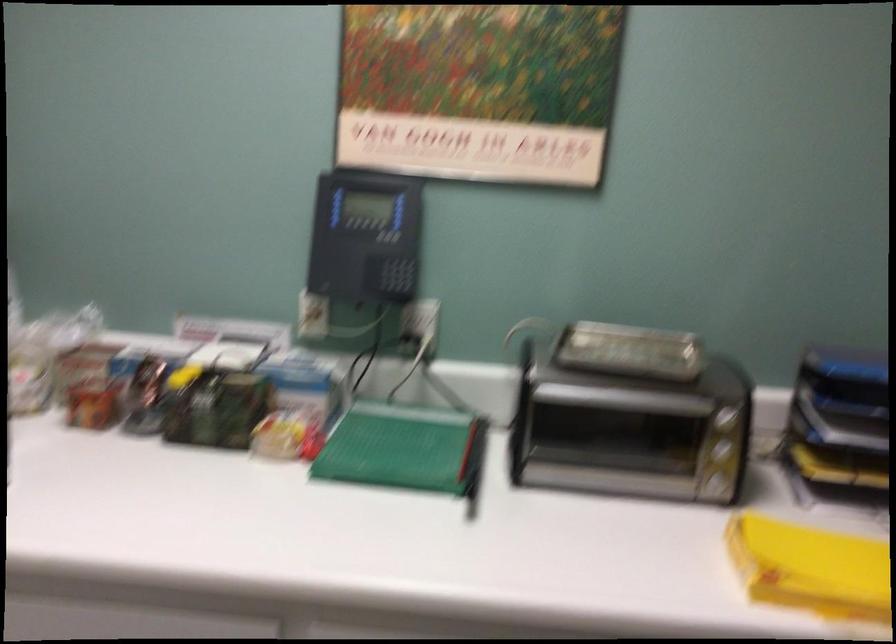
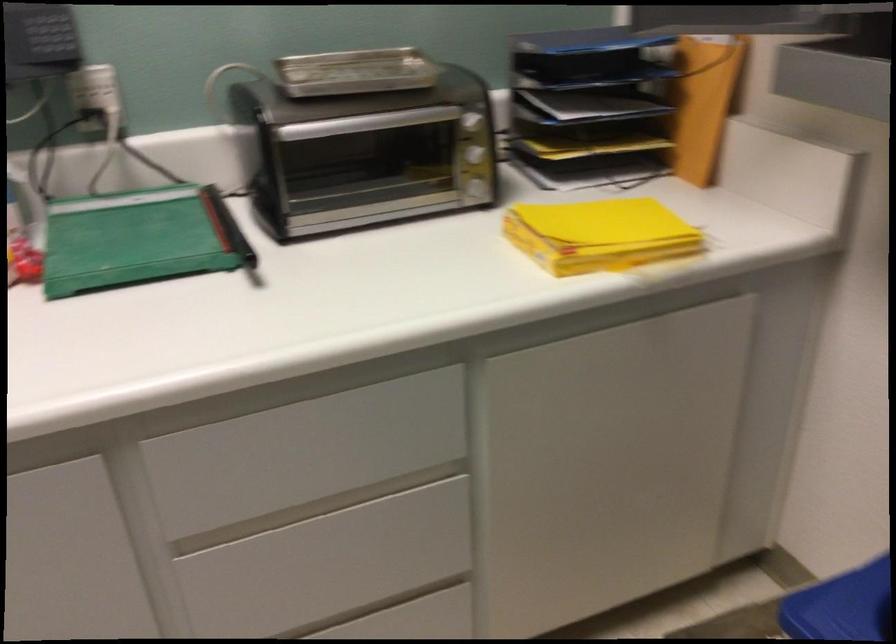
Where in the second image is the point corresponding to (730,418) from the first image?

(471, 120)